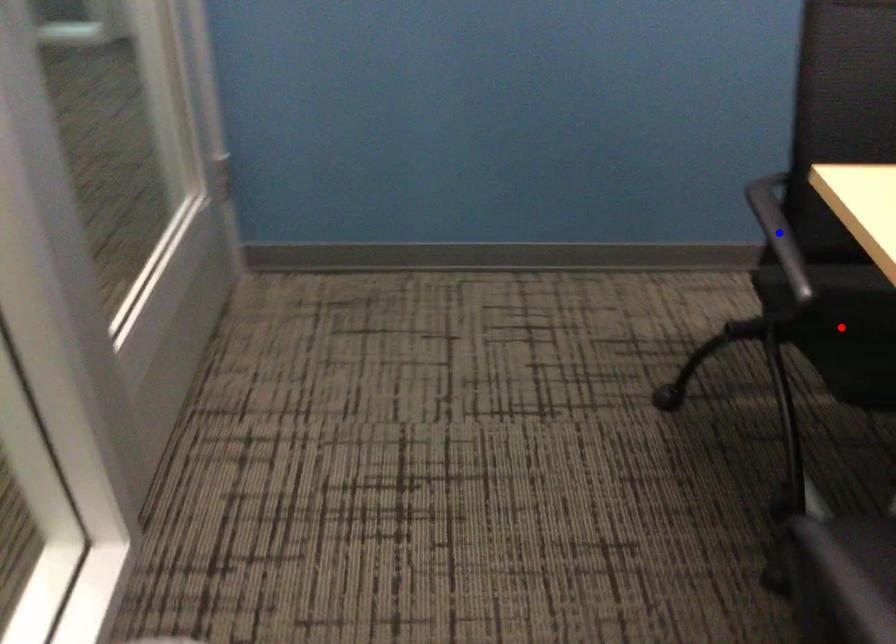
Question: In the image, two points are highlighted. Which point is nearer to the camera? Reply with the corresponding letter.

Choices:
 (A) blue point
 (B) red point

Answer: (B)